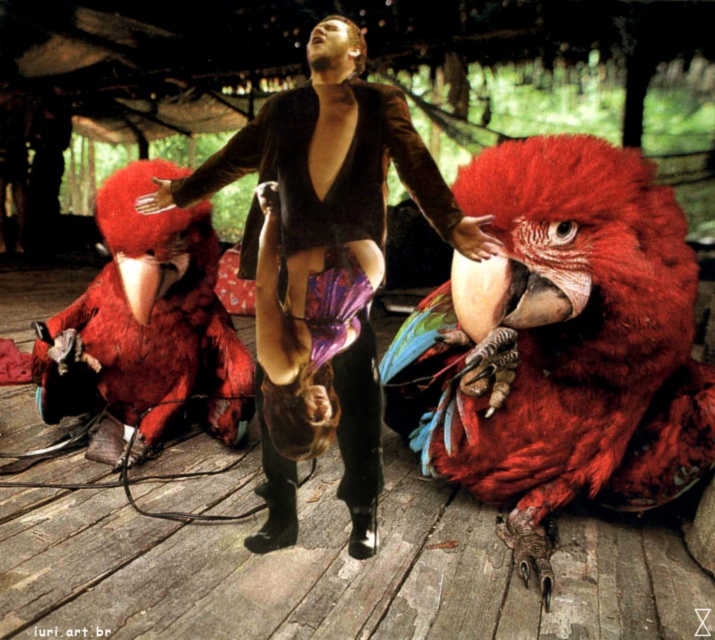
Is velvet brown jacket at center bigger than shiny red parrot at left?

Indeed, velvet brown jacket at center has a larger size compared to shiny red parrot at left.

The image size is (715, 640). What do you see at coordinates (322, 264) in the screenshot? I see `velvet brown jacket at center` at bounding box center [322, 264].

Image resolution: width=715 pixels, height=640 pixels. What are the coordinates of `velvet brown jacket at center` in the screenshot? It's located at (322, 264).

Between shiny red parrot at center and shiny red parrot at left, which one is positioned lower?

shiny red parrot at center

What do you see at coordinates (558, 344) in the screenshot? The height and width of the screenshot is (640, 715). I see `shiny red parrot at center` at bounding box center [558, 344].

Does point (706, 381) come behind point (199, 349)?

That is False.

I want to click on shiny red parrot at center, so click(x=558, y=344).

Between point (556, 337) and point (320, 45), which one is positioned behind?

The point (556, 337) is behind.

Is shiny red parrot at center below velvet brown jacket at center?

Yes.

At what (x,y) coordinates should I click in order to perform the action: click on shiny red parrot at center. Please return your answer as a coordinate pair (x, y). Looking at the image, I should click on (558, 344).